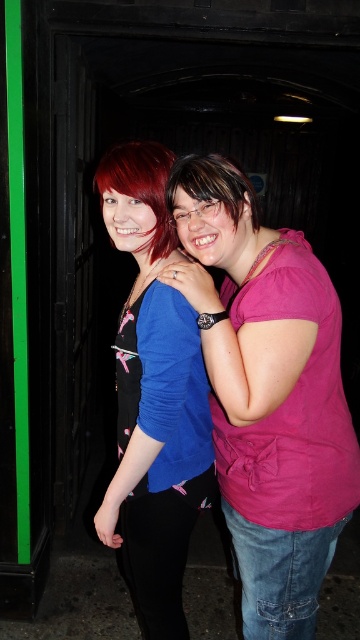
Does pink matte shirt at center have a larger size compared to matte pink shirt at center?

Correct, pink matte shirt at center is larger in size than matte pink shirt at center.

Can you confirm if pink matte shirt at center is thinner than matte pink shirt at center?

No.

Who is more forward, (205,179) or (231,186)?

Point (205,179) is more forward.

You are a GUI agent. You are given a task and a screenshot of the screen. Output one action in this format:
    pyautogui.click(x=<x>, y=<y>)
    Task: Click on the pink matte shirt at center
    This screenshot has height=640, width=360.
    Given the screenshot: What is the action you would take?
    pyautogui.click(x=267, y=394)

Is pink matte shirt at center shorter than blue fabric shirt at center?

Yes, pink matte shirt at center is shorter than blue fabric shirt at center.

Does pink matte shirt at center appear on the right side of blue fabric shirt at center?

Indeed, pink matte shirt at center is positioned on the right side of blue fabric shirt at center.

You are a GUI agent. You are given a task and a screenshot of the screen. Output one action in this format:
    pyautogui.click(x=<x>, y=<y>)
    Task: Click on the pink matte shirt at center
    
    Given the screenshot: What is the action you would take?
    pyautogui.click(x=267, y=394)

Who is higher up, shiny red hair at center or matte pink shirt at center?

matte pink shirt at center is above.

Find the location of a particular element. This screenshot has height=640, width=360. shiny red hair at center is located at coordinates (141, 188).

Find the location of a particular element. shiny red hair at center is located at coordinates (141, 188).